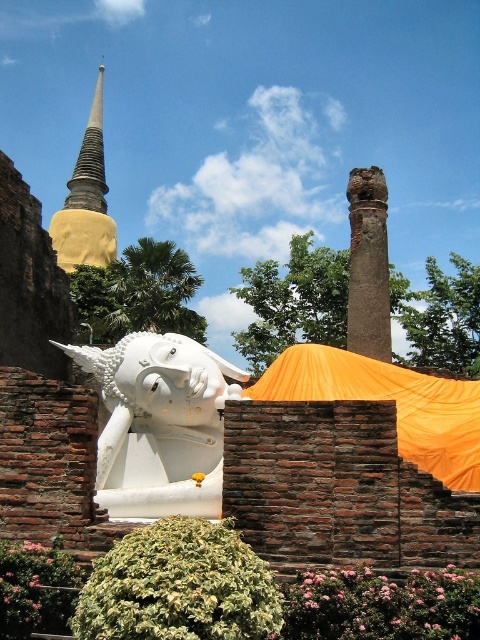
Question: Which point is farther to the camera?

Choices:
 (A) white glossy statue at center
 (B) orange fabric canopy at center
 (C) smooth gold spire at upper left

Answer: (C)

Question: Is orange fabric canopy at center bigger than smooth gold spire at upper left?

Choices:
 (A) yes
 (B) no

Answer: (B)

Question: Which object is the farthest from the white glossy statue at center?

Choices:
 (A) orange fabric canopy at center
 (B) smooth gold spire at upper left

Answer: (B)

Question: Is white glossy statue at center above orange fabric canopy at center?

Choices:
 (A) yes
 (B) no

Answer: (B)

Question: Is white glossy statue at center positioned behind smooth gold spire at upper left?

Choices:
 (A) no
 (B) yes

Answer: (A)

Question: Which is nearer to the white glossy statue at center?

Choices:
 (A) smooth gold spire at upper left
 (B) orange fabric canopy at center

Answer: (B)